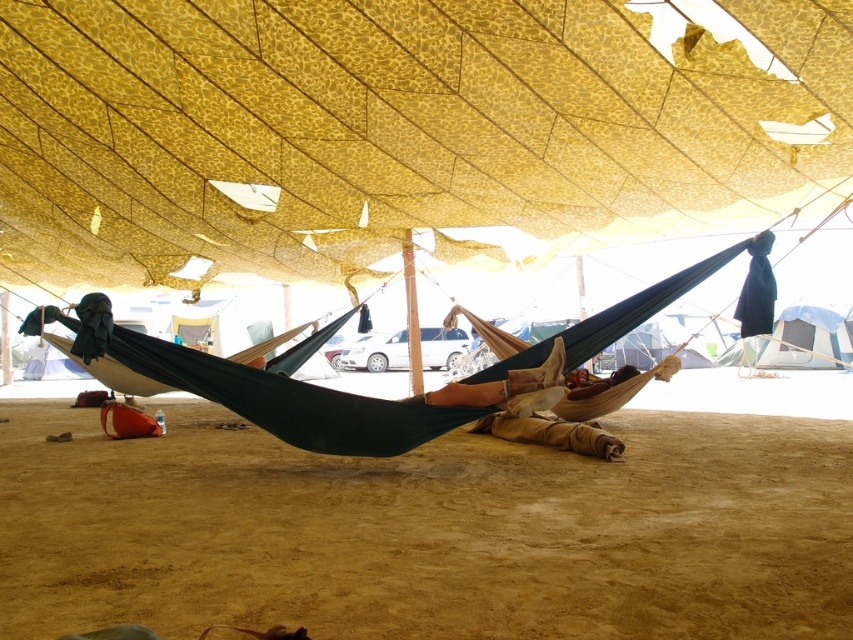
Does point (786, 360) come farther from viewer compared to point (572, 397)?

Yes, it is behind point (572, 397).

Is point (717, 362) farther from camera compared to point (618, 369)?

Yes, point (717, 362) is behind point (618, 369).

In order to click on white canvas tent at upper right in this screenshot , I will do `click(798, 340)`.

Is dark blue fabric hammock at center taller than wooden chair at center?

Yes.

In the scene shown: How much distance is there between dark blue fabric hammock at center and wooden chair at center?

A distance of 2.41 meters exists between dark blue fabric hammock at center and wooden chair at center.

Is point (751, 298) farther from camera compared to point (579, 394)?

That is False.

Identify the location of dark blue fabric hammock at center. The image size is (853, 640). (291, 401).

Based on the photo, does sandy brown sand at lower center have a smaller size compared to wooden chair at center?

No.

Does sandy brown sand at lower center appear on the right side of wooden chair at center?

In fact, sandy brown sand at lower center is to the left of wooden chair at center.

Who is more distant from viewer, [90,424] or [625,378]?

Point [90,424]

At what (x,y) coordinates should I click in order to perform the action: click on sandy brown sand at lower center. Please return your answer as a coordinate pair (x, y). The width and height of the screenshot is (853, 640). Looking at the image, I should click on (428, 531).